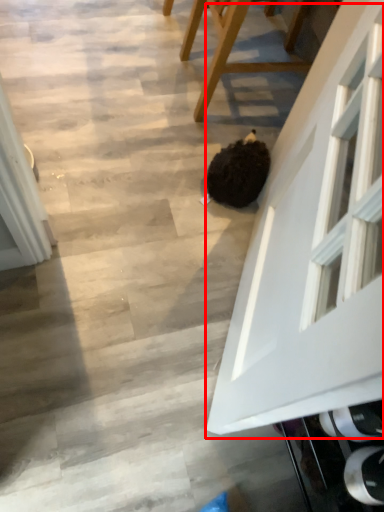
Question: Considering the relative positions of glass door (annotated by the red box) and furniture in the image provided, where is glass door (annotated by the red box) located with respect to the staircase?

Choices:
 (A) left
 (B) right

Answer: (A)